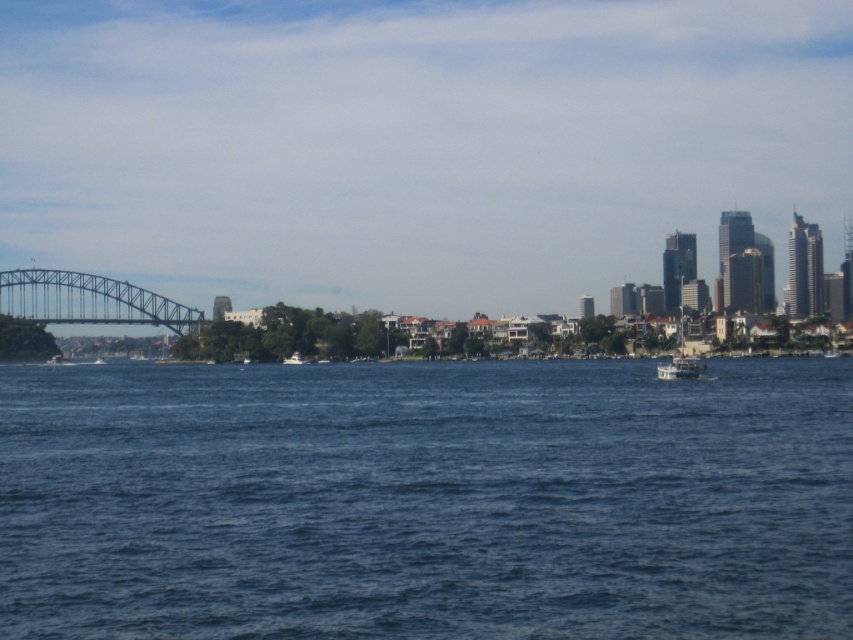
You are standing at the viewpoint of the image and want to determine the relative positions of two points in the scene. Which of the two points, point (741, 579) or point (299, 358), is closer to you?

Point (741, 579) is closer to the camera than point (299, 358).

You are standing at the point with coordinates point (693, 372) and want to walk to the point with coordinates point (71, 292). Is there a clear path between these two points without any obstacles?

Point (71, 292) is behind point (693, 372), so there might be an obstacle blocking the direct path between them. You may need to find an alternative route around point (693, 372) to reach point (71, 292).